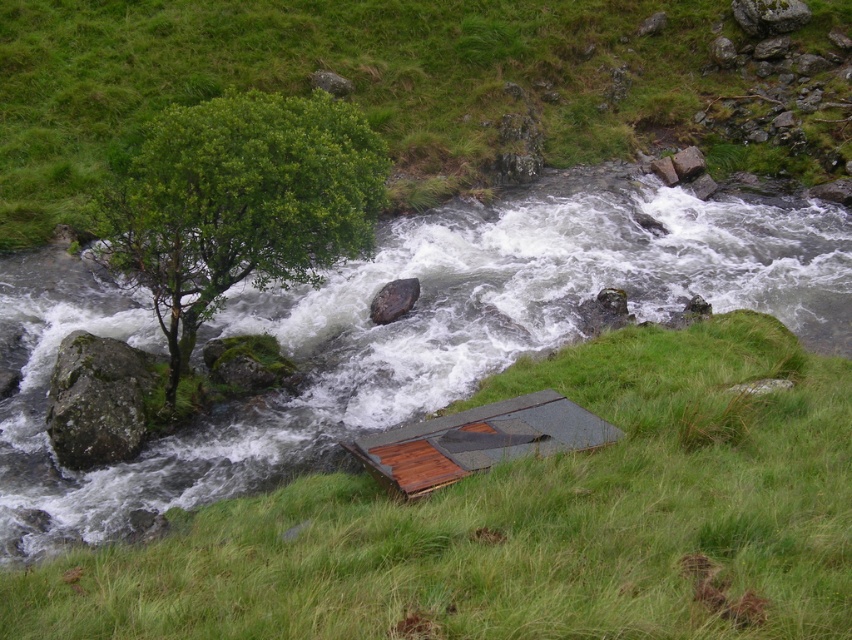
You are standing at the point marked by the coordinates point (478,440) in the image. Looking around, you see a gray wooden hut at lower center. What is the nearest object to you in this scene?

The nearest object to you is the gray wooden hut at lower center because you are standing at its coordinates.

You are a hiker trying to cross the river using the green grassy at lower center and the brown rough rock at center. Which one is shorter and safer to step on?

The green grassy at lower center is not as tall as brown rough rock at center, so the green grassy at lower center is shorter and safer to step on.